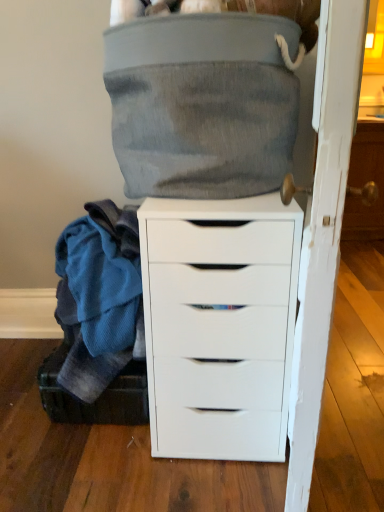
Locate an element on the screen. The image size is (384, 512). vacant region to the left of black fabric shoe box at lower left is located at coordinates (19, 387).